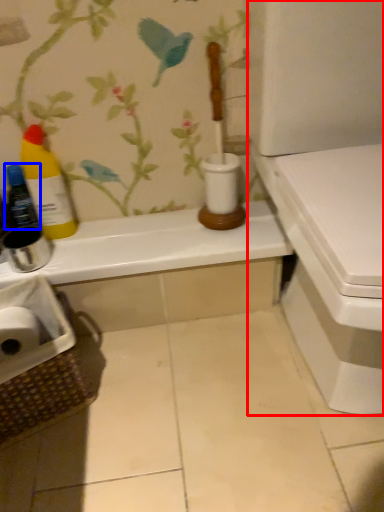
Question: Among these objects, which one is farthest to the camera, toilet (highlighted by a red box) or bottle (highlighted by a blue box)?

Choices:
 (A) toilet
 (B) bottle

Answer: (B)